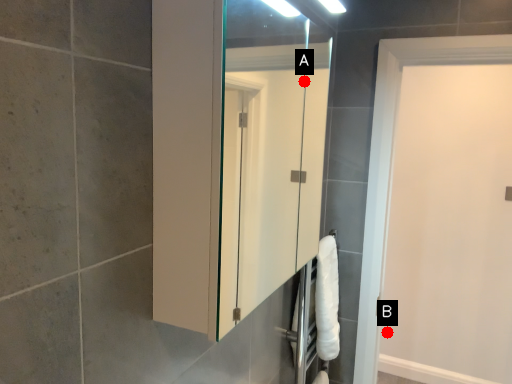
Question: Two points are circled on the image, labeled by A and B beside each circle. Which point appears farthest from the camera in this image?

Choices:
 (A) A is further
 (B) B is further

Answer: (B)